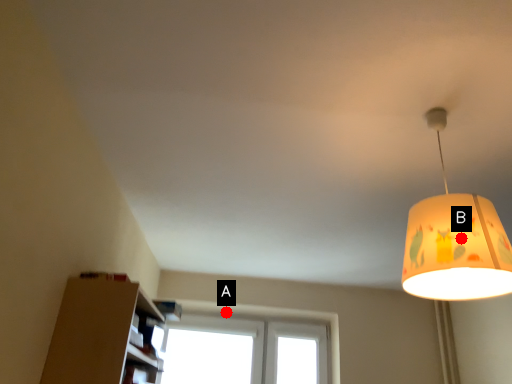
Question: Two points are circled on the image, labeled by A and B beside each circle. Among these points, which one is nearest to the camera?

Choices:
 (A) A is closer
 (B) B is closer

Answer: (B)